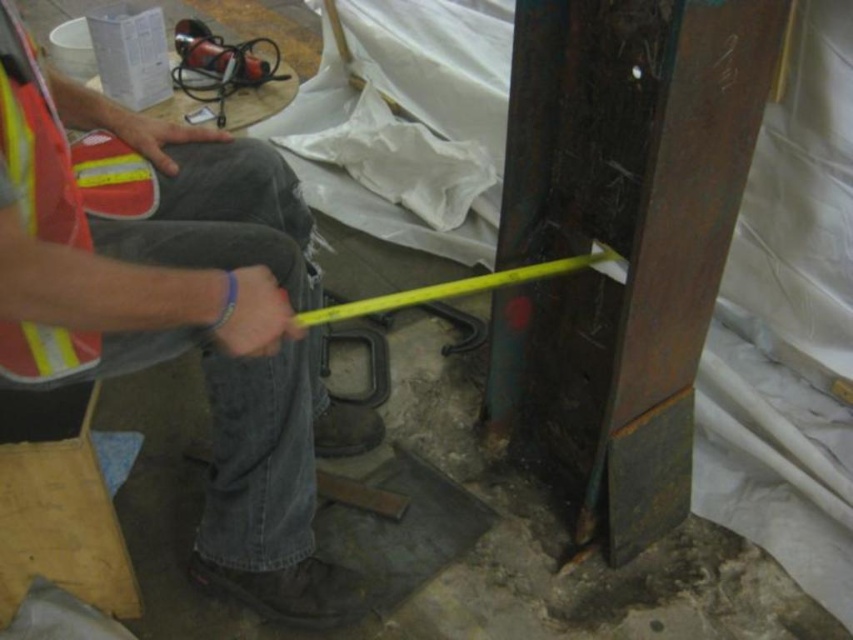
You are an inspector reviewing the safety protocols in the construction site shown in the image. The safety guidelines state that all workers must keep their lower body within a safe zone marked by coordinates between 0.3 and 0.7 on the horizontal axis and between 0.15 and 0.25 on the vertical axis. Does the denim jeans at center comply with this safety zone requirement based on its position?

The denim jeans at center is positioned at point (178,314). The horizontal coordinate 0.492 falls within the 0.3 to 0.7 range, and the vertical coordinate 0.211 is within the 0.15 to 0.25 range. Therefore, the denim jeans at center complies with the safety zone requirement.

You are an inspector checking the safety of the construction site. You notice a point at coordinates (178, 314) in the image. What object does this point correspond to?

The point at coordinates (178, 314) corresponds to the denim jeans at center.

You are an inspector checking safety gear in a construction site. You notice two items labeled denim jeans at center and reflective fabric safety vest at left. Which item has a larger size?

The denim jeans at center is bigger than reflective fabric safety vest at left, so the denim jeans at center has a larger size.